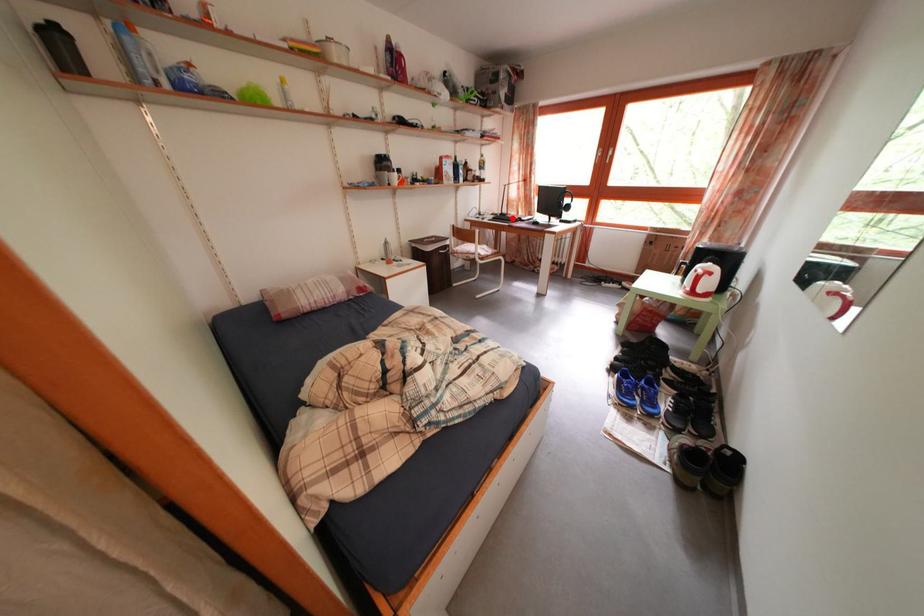
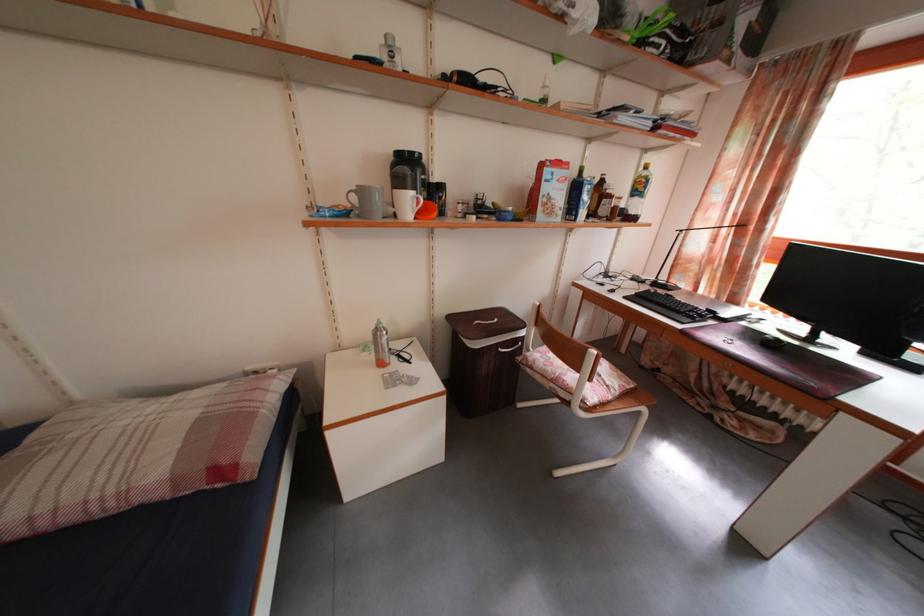
Where in the second image is the point corresponding to the highlighted location from the first image?

(671, 285)